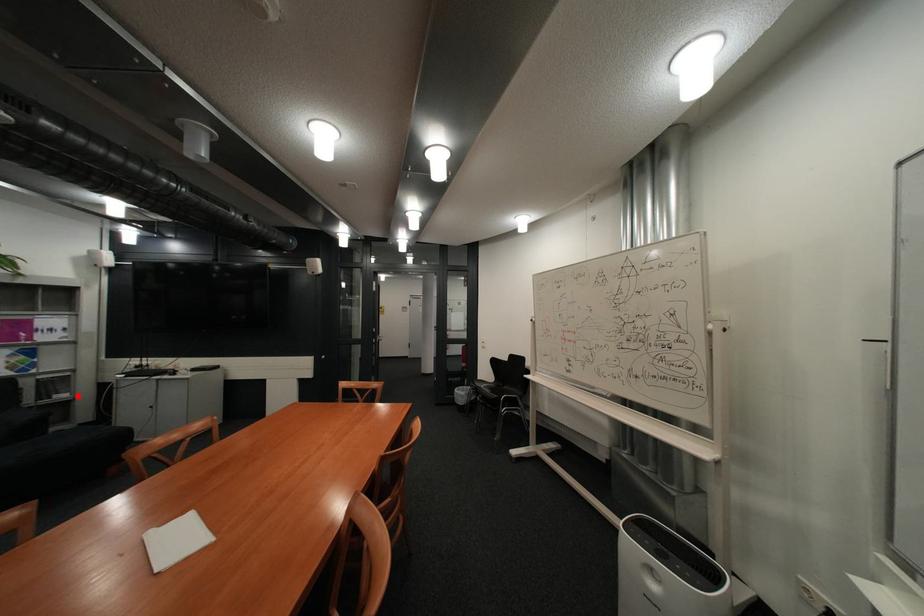
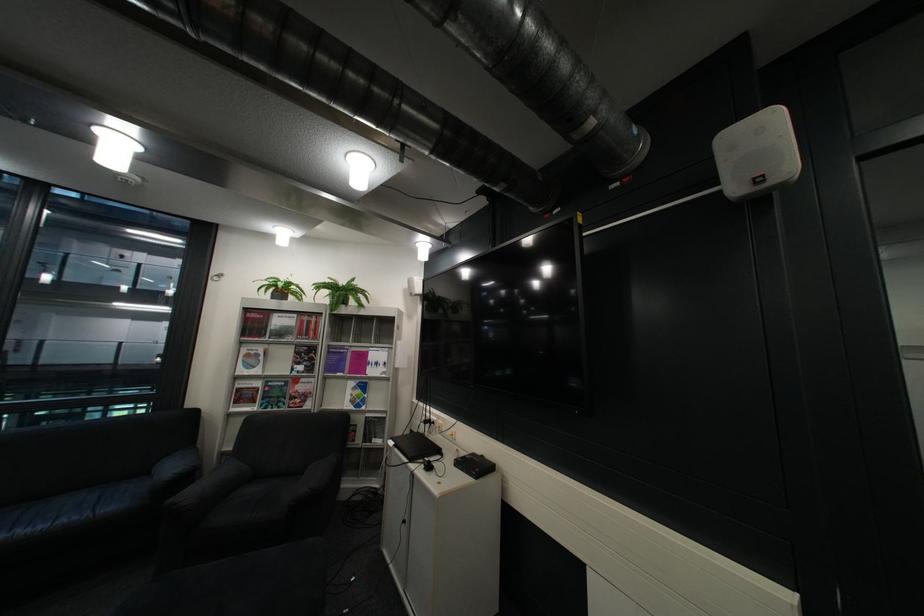
Question: A red point is marked in image1. In image2, is the corresponding 3D point closer to the camera or farther? Reply with the corresponding letter.

Choices:
 (A) The corresponding 3D point is closer.
 (B) The corresponding 3D point is farther.

Answer: (B)